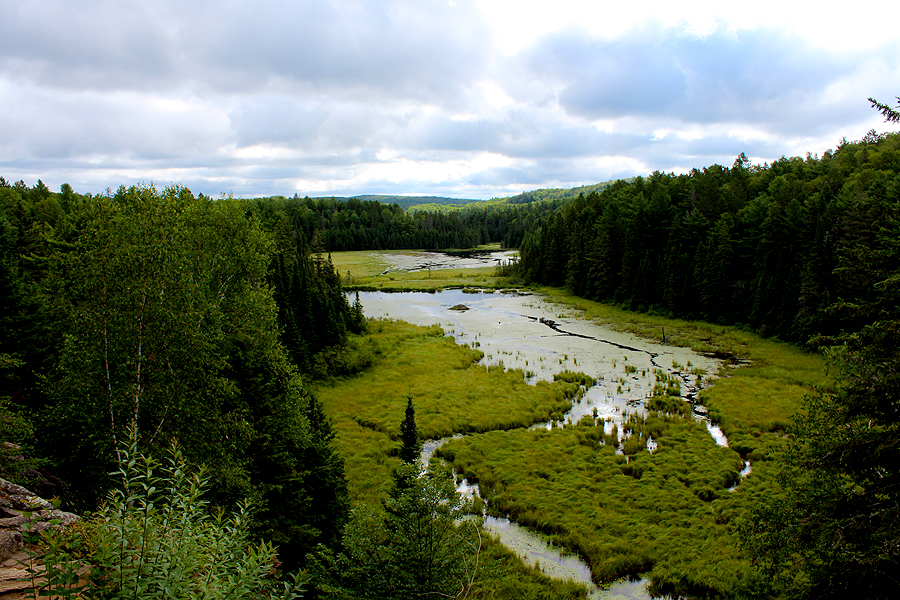
The image size is (900, 600). I want to click on plant, so click(x=157, y=529).